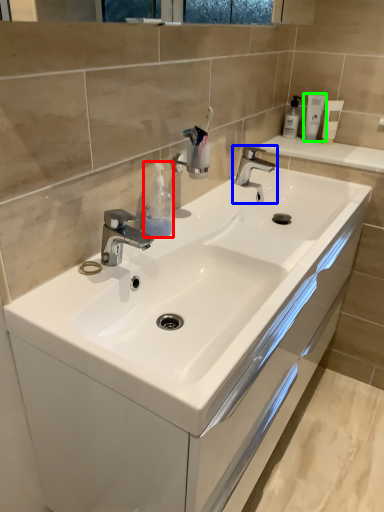
Question: Based on their relative distances, which object is nearer to soap dispenser (highlighted by a red box)? Choose from tap (highlighted by a blue box) and mouthwash (highlighted by a green box).

Choices:
 (A) tap
 (B) mouthwash

Answer: (A)